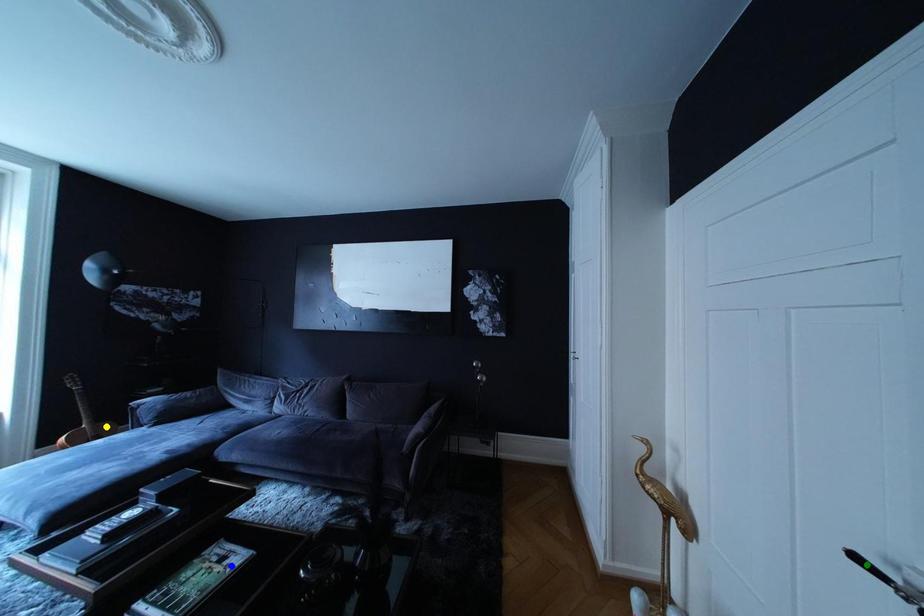
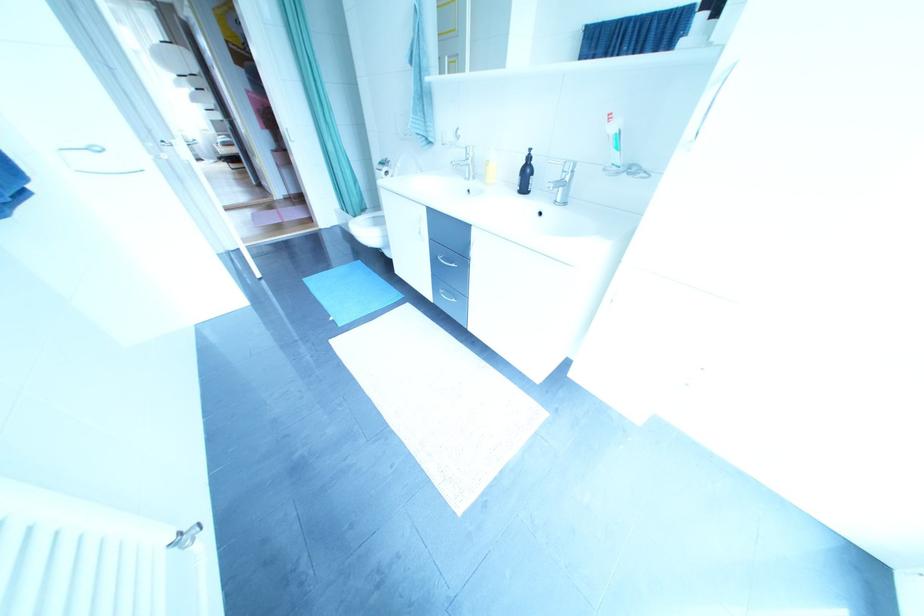
I am providing you with two images of the same scene from different viewpoints. Three points are marked in image1. Which point corresponds to a part or object that is occluded in image2?In image1, three points are marked. Which of them correspond to a part or object that is occluded in image2?Among the three points shown in image1, which one corresponds to a part or object that is no longer visible due to occlusion in image2?

Invisible in image2: green point, blue point, yellow point.